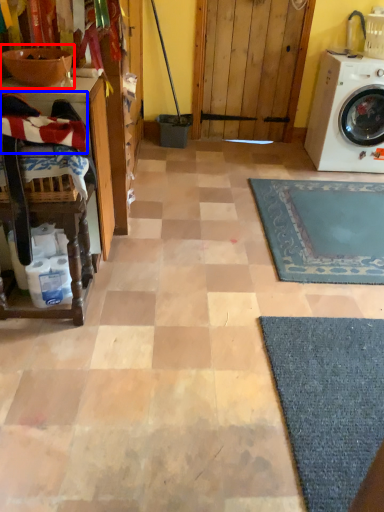
Question: Among these objects, which one is farthest to the camera, sink (highlighted by a red box) or laundry (highlighted by a blue box)?

Choices:
 (A) sink
 (B) laundry

Answer: (A)